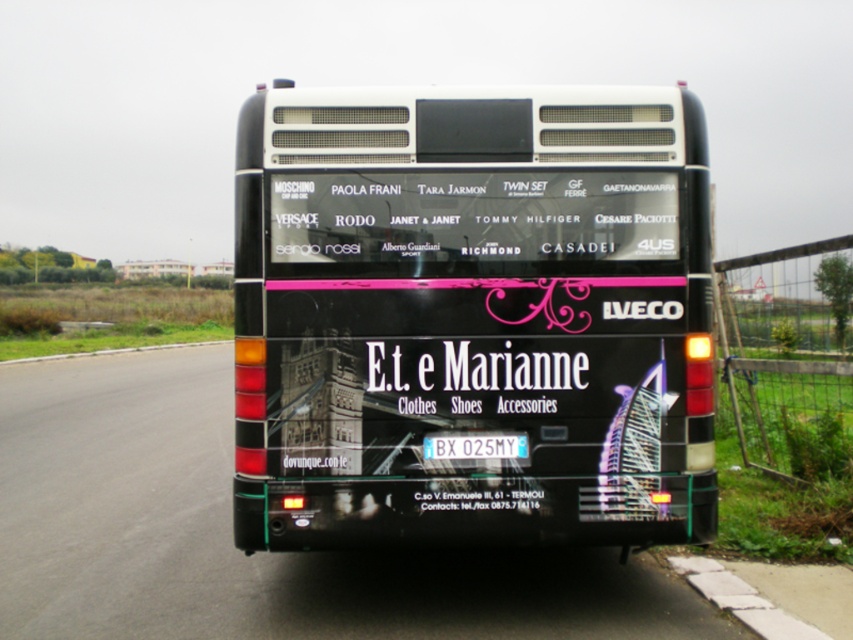
Question: Is black glossy bus at center wider than blue metallic license plate at center?

Choices:
 (A) yes
 (B) no

Answer: (A)

Question: Is black glossy bus at center bigger than blue metallic license plate at center?

Choices:
 (A) yes
 (B) no

Answer: (A)

Question: Can you confirm if black glossy bus at center is wider than blue metallic license plate at center?

Choices:
 (A) yes
 (B) no

Answer: (A)

Question: Which point is farther to the camera?

Choices:
 (A) (386, 196)
 (B) (457, 451)

Answer: (A)

Question: Among these points, which one is nearest to the camera?

Choices:
 (A) (282, 524)
 (B) (502, 456)

Answer: (A)